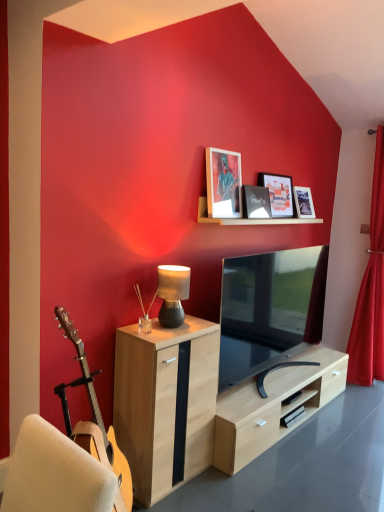
Image resolution: width=384 pixels, height=512 pixels. I want to click on matte black picture frame at upper center, marked as the 3th picture frame in a left-to-right arrangement, so click(x=278, y=194).

This screenshot has height=512, width=384. What do you see at coordinates (269, 311) in the screenshot?
I see `matte black tv at center` at bounding box center [269, 311].

Describe the element at coordinates (303, 202) in the screenshot. This screenshot has height=512, width=384. I see `matte black picture frame at upper right, the 4th picture frame in the left-to-right sequence` at that location.

How much space does matte black picture frame at upper right, the 1th picture frame from the right, occupy horizontally?

The width of matte black picture frame at upper right, the 1th picture frame from the right, is 5.73 inches.

Identify the location of matte black picture frame at upper center, placed as the second picture frame when sorted from right to left. The width and height of the screenshot is (384, 512). (278, 194).

Does matte black picture frame at upper center, which is the 3th picture frame in right-to-left order, turn towards matte black tv at center?

No, matte black picture frame at upper center, which is the 3th picture frame in right-to-left order, is not oriented towards matte black tv at center.

Between matte black picture frame at upper center, which is the 3th picture frame in right-to-left order, and matte black tv at center, which one has less height?

With less height is matte black picture frame at upper center, which is the 3th picture frame in right-to-left order.

Is matte black picture frame at upper center, which is the 3th picture frame in right-to-left order, located outside matte black tv at center?

matte black picture frame at upper center, which is the 3th picture frame in right-to-left order, lies outside matte black tv at center's area.

Is matte black picture frame at upper center, which is the 3th picture frame in right-to-left order, in contact with light wood cabinet at center?

matte black picture frame at upper center, which is the 3th picture frame in right-to-left order, is not next to light wood cabinet at center, and they're not touching.

Considering the positions of point (248, 194) and point (163, 389), is point (248, 194) closer or farther from the camera than point (163, 389)?

Point (248, 194) is positioned farther from the camera compared to point (163, 389).

Is matte black picture frame at upper center, marked as the 2th picture frame in a left-to-right arrangement, further to the viewer compared to light wood cabinet at center?

Yes, it is behind light wood cabinet at center.

From a real-world perspective, does matte black picture frame at upper center, placed as the second picture frame when sorted from right to left, stand above matte black picture frame at upper right, the 1th picture frame from the right?

Yes, from a real-world perspective, matte black picture frame at upper center, placed as the second picture frame when sorted from right to left, is over matte black picture frame at upper right, the 1th picture frame from the right

How different are the orientations of matte black picture frame at upper center, placed as the second picture frame when sorted from right to left, and matte black picture frame at upper right, the 4th picture frame in the left-to-right sequence, in degrees?

The facing directions of matte black picture frame at upper center, placed as the second picture frame when sorted from right to left, and matte black picture frame at upper right, the 4th picture frame in the left-to-right sequence, are 1.47 degrees apart.

Is matte black picture frame at upper center, placed as the second picture frame when sorted from right to left, in front of matte black picture frame at upper right, the 4th picture frame in the left-to-right sequence?

Yes, it is in front of matte black picture frame at upper right, the 4th picture frame in the left-to-right sequence.

Can you confirm if light brown acoustic guitar at left is shorter than matte black picture frame at upper center, which is the 3th picture frame in right-to-left order?

Incorrect, the height of light brown acoustic guitar at left does not fall short of that of matte black picture frame at upper center, which is the 3th picture frame in right-to-left order.

The width and height of the screenshot is (384, 512). In order to click on guitar below the matte black picture frame at upper center, marked as the 2th picture frame in a left-to-right arrangement (from the image's perspective) in this screenshot , I will do tap(94, 418).

What's the angular difference between light brown acoustic guitar at left and matte black picture frame at upper center, marked as the 2th picture frame in a left-to-right arrangement,'s facing directions?

light brown acoustic guitar at left and matte black picture frame at upper center, marked as the 2th picture frame in a left-to-right arrangement, are facing 1.27 degrees away from each other.

Is light brown acoustic guitar at left inside the boundaries of matte black picture frame at upper center, marked as the 2th picture frame in a left-to-right arrangement, or outside?

light brown acoustic guitar at left is not enclosed by matte black picture frame at upper center, marked as the 2th picture frame in a left-to-right arrangement.

Between light brown acoustic guitar at left and beech wood desk at lower center, which one has smaller size?

With smaller size is beech wood desk at lower center.

Is light brown acoustic guitar at left with beech wood desk at lower center?

No, light brown acoustic guitar at left is not beside beech wood desk at lower center.

Is light brown acoustic guitar at left located outside beech wood desk at lower center?

light brown acoustic guitar at left lies outside beech wood desk at lower center's area.

Looking at this image, considering the sizes of light brown acoustic guitar at left and beech wood desk at lower center in the image, is light brown acoustic guitar at left wider or thinner than beech wood desk at lower center?

light brown acoustic guitar at left is thinner than beech wood desk at lower center.

Considering the relative sizes of red velvet curtain at right and light wood cabinet at center in the image provided, is red velvet curtain at right taller than light wood cabinet at center?

Correct, red velvet curtain at right is much taller as light wood cabinet at center.

Is red velvet curtain at right wider than light wood cabinet at center?

No, red velvet curtain at right is not wider than light wood cabinet at center.

Considering the points (377, 341) and (157, 447), which point is behind, point (377, 341) or point (157, 447)?

The point (377, 341) is behind.

Is the depth of red velvet curtain at right less than that of light wood cabinet at center?

No, it is not.

Which of these two, matte black tv at center or matte black picture frame at upper center, placed as the second picture frame when sorted from right to left, is smaller?

matte black picture frame at upper center, placed as the second picture frame when sorted from right to left.

Based on the photo, is matte black tv at center at the left side of matte black picture frame at upper center, placed as the second picture frame when sorted from right to left?

In fact, matte black tv at center is to the right of matte black picture frame at upper center, placed as the second picture frame when sorted from right to left.

Considering the sizes of matte black tv at center and matte black picture frame at upper center, placed as the second picture frame when sorted from right to left, in the image, is matte black tv at center taller or shorter than matte black picture frame at upper center, placed as the second picture frame when sorted from right to left,?

matte black tv at center is taller than matte black picture frame at upper center, placed as the second picture frame when sorted from right to left.

Is matte black picture frame at upper center, marked as the 3th picture frame in a left-to-right arrangement, inside matte black tv at center?

No, matte black picture frame at upper center, marked as the 3th picture frame in a left-to-right arrangement, is located outside of matte black tv at center.

From the image's perspective, which picture frame is the 1st one above the matte black tv at center? Please provide its 2D coordinates.

[(256, 202)]

Locate an element on the screen. cabinetry below the matte black picture frame at upper center, marked as the 2th picture frame in a left-to-right arrangement (from a real-world perspective) is located at coordinates (165, 403).

Which object lies further to the anchor point matte black picture frame at upper center, marked as the 2th picture frame in a left-to-right arrangement, matte black picture frame at upper center, marked as the 3th picture frame in a left-to-right arrangement, or matte black picture frame at upper right, the 1th picture frame from the right?

matte black picture frame at upper right, the 1th picture frame from the right, lies further to matte black picture frame at upper center, marked as the 2th picture frame in a left-to-right arrangement, than the other object.

Based on their spatial positions, is matte black picture frame at upper center, placed as the second picture frame when sorted from right to left, or matte black lamp at center closer to red velvet curtain at right?

matte black picture frame at upper center, placed as the second picture frame when sorted from right to left.

Looking at the image, which one is located closer to light brown acoustic guitar at left, matte black tv at center or wooden shelf at upper center?

Based on the image, matte black tv at center appears to be nearer to light brown acoustic guitar at left.

Looking at the image, which one is located further to matte black lamp at center, matte black tv at center or matte black picture frame at upper right, the 1th picture frame from the right?

matte black picture frame at upper right, the 1th picture frame from the right, is positioned further to the anchor matte black lamp at center.

Which object lies nearer to the anchor point matte glass picture frame at upper center, placed as the first picture frame when sorted from left to right, wooden shelf at upper center or matte black picture frame at upper right, the 4th picture frame in the left-to-right sequence?

The object closer to matte glass picture frame at upper center, placed as the first picture frame when sorted from left to right, is wooden shelf at upper center.

Considering their positions, is light brown acoustic guitar at left positioned further to light wood cabinet at center than matte glass picture frame at upper center, arranged as the 4th picture frame when viewed from the right?

matte glass picture frame at upper center, arranged as the 4th picture frame when viewed from the right, is positioned further to the anchor light wood cabinet at center.

From the image, which object appears to be farther from red velvet curtain at right, matte black tv at center or matte black lamp at center?

matte black lamp at center is positioned further to the anchor red velvet curtain at right.

Estimate the real-world distances between objects in this image. Which object is further from matte glass picture frame at upper center, arranged as the 4th picture frame when viewed from the right, light brown acoustic guitar at left or matte black picture frame at upper right, the 1th picture frame from the right?

Among the two, light brown acoustic guitar at left is located further to matte glass picture frame at upper center, arranged as the 4th picture frame when viewed from the right.

This screenshot has height=512, width=384. What are the coordinates of `television that lies between matte glass picture frame at upper center, arranged as the 4th picture frame when viewed from the right, and beech wood desk at lower center from top to bottom` in the screenshot? It's located at (269, 311).

I want to click on picture frame between matte glass picture frame at upper center, placed as the first picture frame when sorted from left to right, and wooden shelf at upper center from left to right, so click(256, 202).

Where is `cabinetry between matte black picture frame at upper center, marked as the 2th picture frame in a left-to-right arrangement, and beech wood desk at lower center, in the vertical direction`? cabinetry between matte black picture frame at upper center, marked as the 2th picture frame in a left-to-right arrangement, and beech wood desk at lower center, in the vertical direction is located at coordinates (165, 403).

Where is `shelf between matte glass picture frame at upper center, placed as the first picture frame when sorted from left to right, and beech wood desk at lower center vertically`? shelf between matte glass picture frame at upper center, placed as the first picture frame when sorted from left to right, and beech wood desk at lower center vertically is located at coordinates (248, 219).